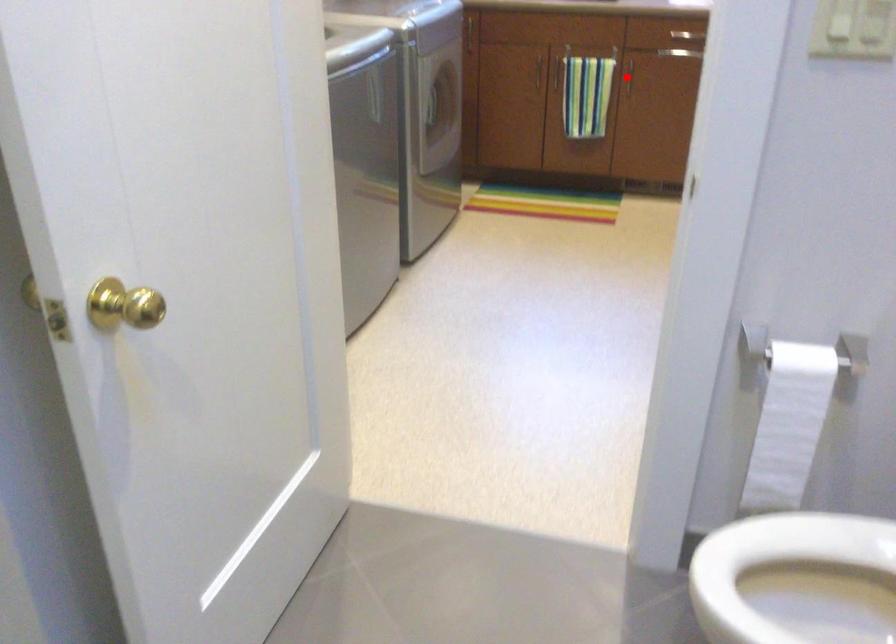
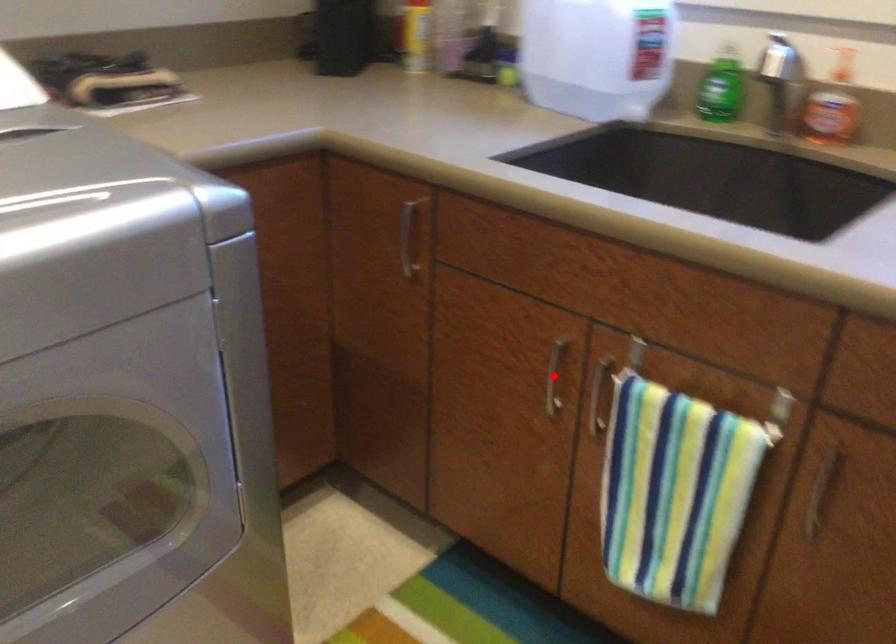
I am providing you with two images of the same scene from different viewpoints. A red point is marked on the first image and another point is marked on the second image. Do the highlighted points in image1 and image2 indicate the same real-world spot?

No